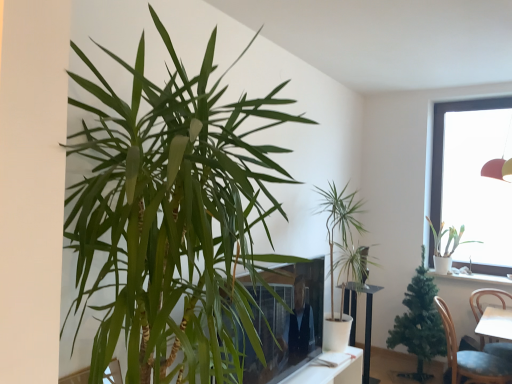
Locate an element on the screen. The width and height of the screenshot is (512, 384). green matte artificial tree at lower right, which is the 3th houseplant from front to back is located at coordinates (419, 323).

What do you see at coordinates (368, 332) in the screenshot? This screenshot has width=512, height=384. I see `white glossy round table at center` at bounding box center [368, 332].

Identify the location of green leafy plant at center, positioned as the second houseplant in front-to-back order. (339, 220).

Describe the element at coordinates (471, 357) in the screenshot. I see `blue fabric chair at lower right` at that location.

Where is `green leafy plant at left, which is the fourth houseplant in right-to-left order`? This screenshot has height=384, width=512. green leafy plant at left, which is the fourth houseplant in right-to-left order is located at coordinates (172, 219).

Is green leafy plant at left, arranged as the fourth houseplant when viewed from the back, positioned behind white ceramic pot at upper right?

No, the depth of green leafy plant at left, arranged as the fourth houseplant when viewed from the back, is less than that of white ceramic pot at upper right.

From a real-world perspective, between green leafy plant at left, arranged as the fourth houseplant when viewed from the back, and white ceramic pot at upper right, who is vertically higher?

From a 3D spatial view, green leafy plant at left, arranged as the fourth houseplant when viewed from the back, is above.

Find the location of a particular element. the 4th houseplant counting from the left side of the white ceramic pot at upper right is located at coordinates (172, 219).

Find the location of a particular element. the 3rd houseplant counting from the right side of the green leafy plant at left, which is the fourth houseplant in right-to-left order is located at coordinates (446, 246).

Which is less distant, (161, 326) or (426, 216)?

Point (161, 326) is closer to the camera than point (426, 216).

Is green leafy plant at left, the first houseplant when ordered from left to right, behind white matte plant at upper right, acting as the 1th houseplant starting from the back?

That is False.

From the image's perspective, count 1st houseplants upward from the white glossy round table at center and point to it. Please provide its 2D coordinates.

[(419, 323)]

Between point (421, 339) and point (369, 303), which one is positioned behind?

Positioned behind is point (421, 339).

Who is smaller, green matte artificial tree at lower right, the second houseplant viewed from the back, or white glossy round table at center?

white glossy round table at center.

Measure the distance between white matte plant at upper right, placed as the 4th houseplant when sorted from left to right, and green matte artificial tree at lower right, the second houseplant viewed from the back.

They are 50.41 centimeters apart.

The image size is (512, 384). I want to click on the 2nd houseplant directly beneath the white matte plant at upper right, placed as the 4th houseplant when sorted from left to right (from a real-world perspective), so click(419, 323).

Which object is closer to the camera taking this photo, white matte plant at upper right, arranged as the fourth houseplant when viewed from the front, or green matte artificial tree at lower right, the second houseplant viewed from the back?

Positioned in front is green matte artificial tree at lower right, the second houseplant viewed from the back.

From the image's perspective, is white matte plant at upper right, placed as the 4th houseplant when sorted from left to right, on top of green matte artificial tree at lower right, which is the 3th houseplant from front to back?

Yes, from the image's perspective, white matte plant at upper right, placed as the 4th houseplant when sorted from left to right, is above green matte artificial tree at lower right, which is the 3th houseplant from front to back.

From the image's perspective, is white ceramic pot at upper right positioned above or below green leafy plant at left, marked as the 1th houseplant in a front-to-back arrangement?

Clearly, from the image's perspective, white ceramic pot at upper right is below green leafy plant at left, marked as the 1th houseplant in a front-to-back arrangement.

In terms of width, does white ceramic pot at upper right look wider or thinner when compared to green leafy plant at left, arranged as the fourth houseplant when viewed from the back?

Clearly, white ceramic pot at upper right has less width compared to green leafy plant at left, arranged as the fourth houseplant when viewed from the back.

Is the depth of white ceramic pot at upper right less than that of green leafy plant at left, the first houseplant when ordered from left to right?

That is False.

Is white ceramic pot at upper right outside of green leafy plant at left, which is the fourth houseplant in right-to-left order?

white ceramic pot at upper right lies outside green leafy plant at left, which is the fourth houseplant in right-to-left order,'s area.

Do you think smooth glass tv at center is within transparent glass window at upper right, or outside of it?

The correct answer is: outside.

From the picture: Who is more distant, smooth glass tv at center or transparent glass window at upper right?

transparent glass window at upper right is behind.

Identify the location of window that appears behind the white glossy round table at center. This screenshot has width=512, height=384. (473, 180).

Could you tell me if transparent glass window at upper right is turned towards white glossy round table at center?

No, transparent glass window at upper right is not oriented towards white glossy round table at center.

Does transparent glass window at upper right touch white glossy round table at center?

transparent glass window at upper right and white glossy round table at center are not in contact.

From a real-world perspective, is transparent glass window at upper right over white glossy round table at center?

Yes, from a real-world perspective, transparent glass window at upper right is over white glossy round table at center

The image size is (512, 384). Identify the location of the 3rd houseplant above the white ceramic pot at upper right (from the image's perspective). (172, 219).

Starting from the green leafy plant at left, marked as the 1th houseplant in a front-to-back arrangement, which houseplant is the 3rd one behind? Please provide its 2D coordinates.

[(446, 246)]

Looking at the image, which one is located further to green matte artificial tree at lower right, placed as the second houseplant when sorted from right to left, green leafy plant at left, marked as the 1th houseplant in a front-to-back arrangement, or white glossy round table at center?

Among the two, green leafy plant at left, marked as the 1th houseplant in a front-to-back arrangement, is located further to green matte artificial tree at lower right, placed as the second houseplant when sorted from right to left.

Looking at the image, which one is located further to transparent glass window at upper right, white matte plant at upper right, arranged as the fourth houseplant when viewed from the front, or white ceramic pot at upper right?

The object further to transparent glass window at upper right is white ceramic pot at upper right.

Considering their positions, is green matte artificial tree at lower right, the second houseplant viewed from the back, positioned closer to white glossy round table at center than green leafy plant at left, which is the fourth houseplant in right-to-left order?

green matte artificial tree at lower right, the second houseplant viewed from the back, lies closer to white glossy round table at center than the other object.

Which object lies further to the anchor point white ceramic pot at upper right, green matte artificial tree at lower right, the second houseplant viewed from the back, or green leafy plant at left, which is the fourth houseplant in right-to-left order?

green leafy plant at left, which is the fourth houseplant in right-to-left order.

Which object lies nearer to the anchor point smooth glass tv at center, blue fabric chair at lower right or green leafy plant at center, the 3th houseplant in the right-to-left sequence?

green leafy plant at center, the 3th houseplant in the right-to-left sequence, lies closer to smooth glass tv at center than the other object.

Looking at the image, which one is located closer to white matte plant at upper right, placed as the 4th houseplant when sorted from left to right, transparent glass window at upper right or smooth glass tv at center?

The object closer to white matte plant at upper right, placed as the 4th houseplant when sorted from left to right, is transparent glass window at upper right.

Based on their spatial positions, is transparent glass window at upper right or green leafy plant at center, the second houseplant from the left, further from white glossy round table at center?

Based on the image, transparent glass window at upper right appears to be further to white glossy round table at center.

Considering their positions, is white ceramic pot at upper right positioned further to green leafy plant at center, the third houseplant positioned from the back, than white glossy round table at center?

white ceramic pot at upper right lies further to green leafy plant at center, the third houseplant positioned from the back, than the other object.

Where is `chair between transparent glass window at upper right and white glossy round table at center vertically`? The height and width of the screenshot is (384, 512). chair between transparent glass window at upper right and white glossy round table at center vertically is located at coordinates (471, 357).

Locate an element on the screen. Image resolution: width=512 pixels, height=384 pixels. round table situated between green leafy plant at center, positioned as the second houseplant in front-to-back order, and white ceramic pot at upper right from left to right is located at coordinates (368, 332).

You are a GUI agent. You are given a task and a screenshot of the screen. Output one action in this format:
    pyautogui.click(x=<x>, y=<y>)
    Task: Click on the houseplant between white glossy round table at center and white matte plant at upper right, arranged as the fourth houseplant when viewed from the front
    
    Given the screenshot: What is the action you would take?
    pyautogui.click(x=419, y=323)

Where is `chair between green leafy plant at left, marked as the 1th houseplant in a front-to-back arrangement, and transparent glass window at upper right, along the z-axis`? chair between green leafy plant at left, marked as the 1th houseplant in a front-to-back arrangement, and transparent glass window at upper right, along the z-axis is located at coordinates (471, 357).